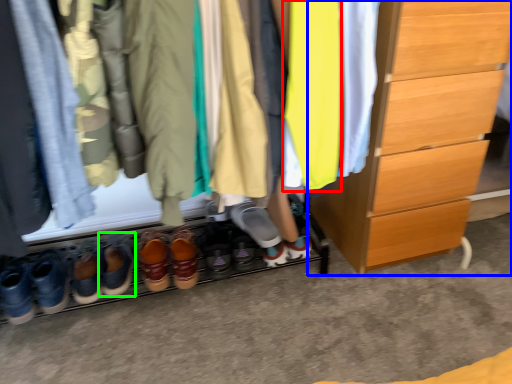
Question: Which is farther away from clothing (highlighted by a red box)? chest of drawers (highlighted by a blue box) or footwear (highlighted by a green box)?

Choices:
 (A) chest of drawers
 (B) footwear

Answer: (B)